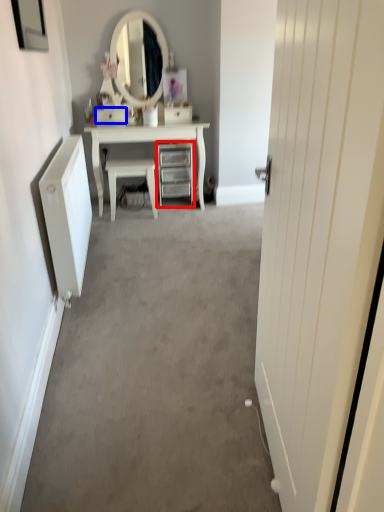
Question: Which object appears closest to the camera in this image, chest of drawers (highlighted by a red box) or drawer (highlighted by a blue box)?

Choices:
 (A) chest of drawers
 (B) drawer

Answer: (B)